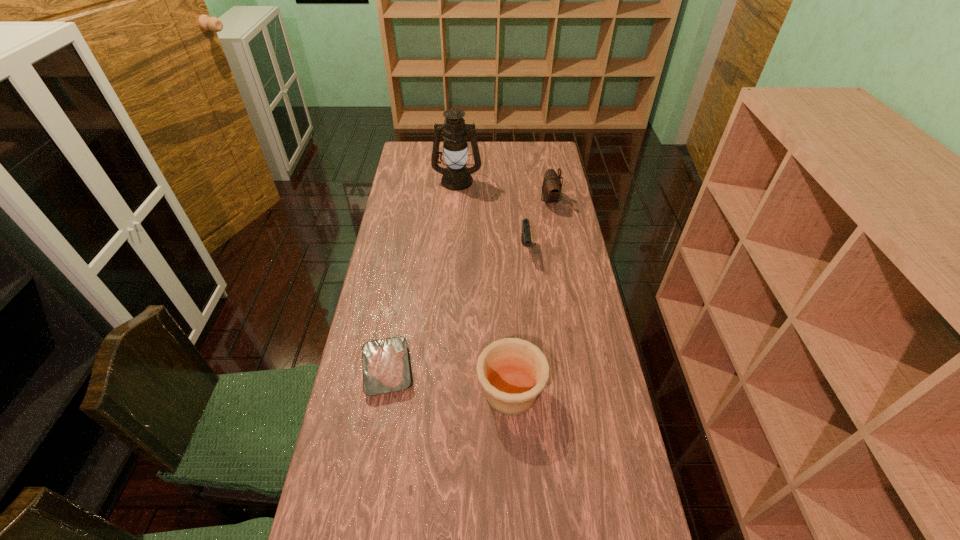
Identify which object is located as the third nearest to the pouch. Please provide its 2D coordinates. Your answer should be formatted as a tuple, i.e. [(x, y)], where the tuple contains the x and y coordinates of a point satisfying the conditions above.

[(513, 372)]

Where is `object that ranks as the third closest to the second shortest object`? This screenshot has width=960, height=540. object that ranks as the third closest to the second shortest object is located at coordinates (513, 372).

Where is `vacant space that satisfies the following two spatial constraints: 1. with the flap open on the rightmost object; 2. at the barrel of the fourth tallest object`? vacant space that satisfies the following two spatial constraints: 1. with the flap open on the rightmost object; 2. at the barrel of the fourth tallest object is located at coordinates (559, 248).

Find the location of a particular element. blank area in the image that satisfies the following two spatial constraints: 1. with the flap open on the rightmost object; 2. on the front side of the pottery is located at coordinates (585, 392).